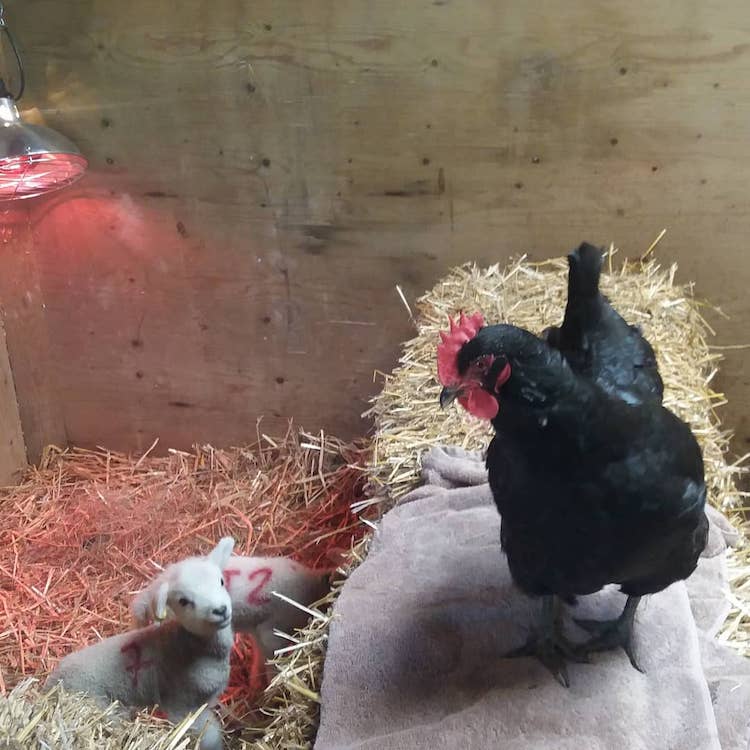
Identify the location of wall. (284, 199).